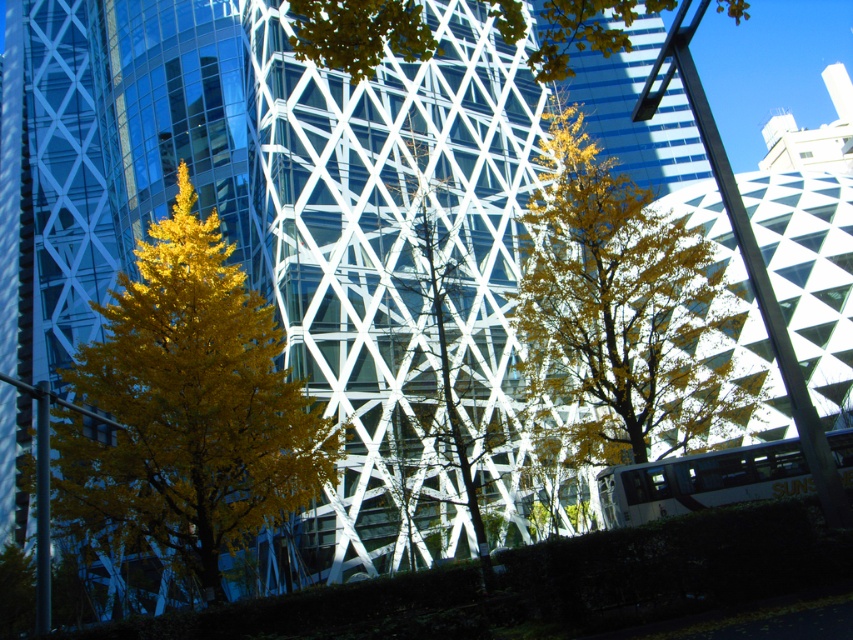
Which of these two, yellow leafy tree at left or yellow leafy tree at upper center, stands taller?

yellow leafy tree at upper center is taller.

Is yellow leafy tree at left smaller than yellow leafy tree at upper center?

Correct, yellow leafy tree at left occupies less space than yellow leafy tree at upper center.

The height and width of the screenshot is (640, 853). I want to click on yellow leafy tree at left, so pyautogui.click(x=186, y=412).

Is point (740, 388) in front of point (306, 17)?

No, (740, 388) is further to viewer.

Does yellow leafy tree at center appear under yellow leafy tree at upper center?

Yes.

Is point (560, 392) closer to camera compared to point (350, 72)?

No, it is behind (350, 72).

Locate an element on the screen. The height and width of the screenshot is (640, 853). yellow leafy tree at center is located at coordinates (621, 312).

Which is behind, point (195, 272) or point (447, 371)?

Positioned behind is point (447, 371).

Identify the location of yellow leafy tree at left. This screenshot has width=853, height=640. (186, 412).